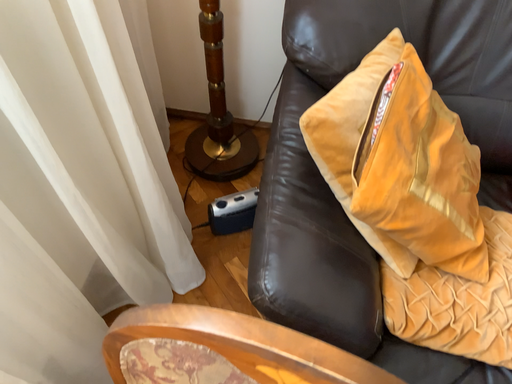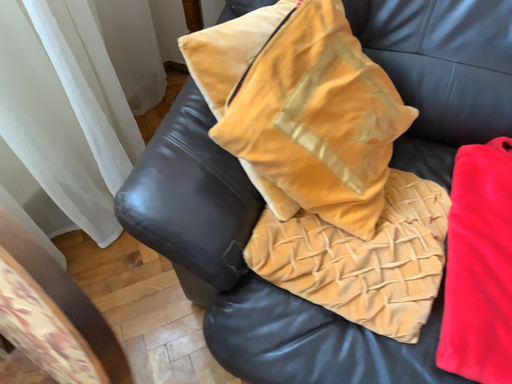
Question: Which way did the camera rotate in the video?

Choices:
 (A) rotated left
 (B) rotated right

Answer: (A)